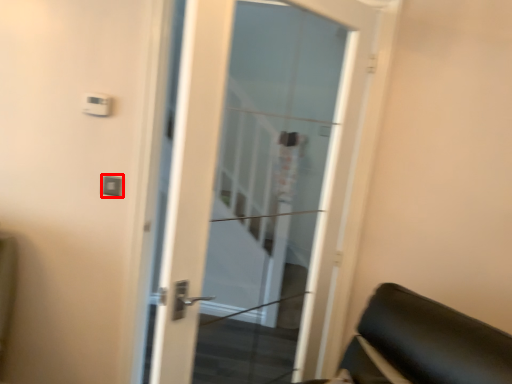
Question: From the image, what is the correct spatial relationship of light switch (annotated by the red box) in relation to door?

Choices:
 (A) left
 (B) right

Answer: (A)